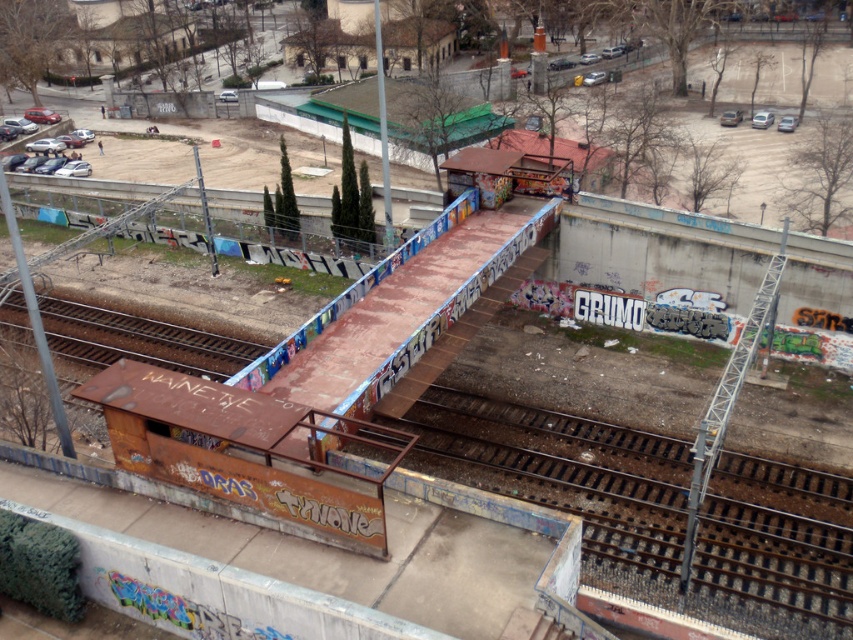
Question: Is rusty metal train track at lower center below rusty metal train track at lower left?

Choices:
 (A) yes
 (B) no

Answer: (A)

Question: Which point is farther from the camera taking this photo?

Choices:
 (A) (757, 630)
 (B) (242, 348)

Answer: (B)

Question: Does rusty metal train track at lower center appear on the right side of rusty metal train track at lower left?

Choices:
 (A) yes
 (B) no

Answer: (A)

Question: Does rusty metal train track at lower center have a larger size compared to rusty metal train track at lower left?

Choices:
 (A) yes
 (B) no

Answer: (A)